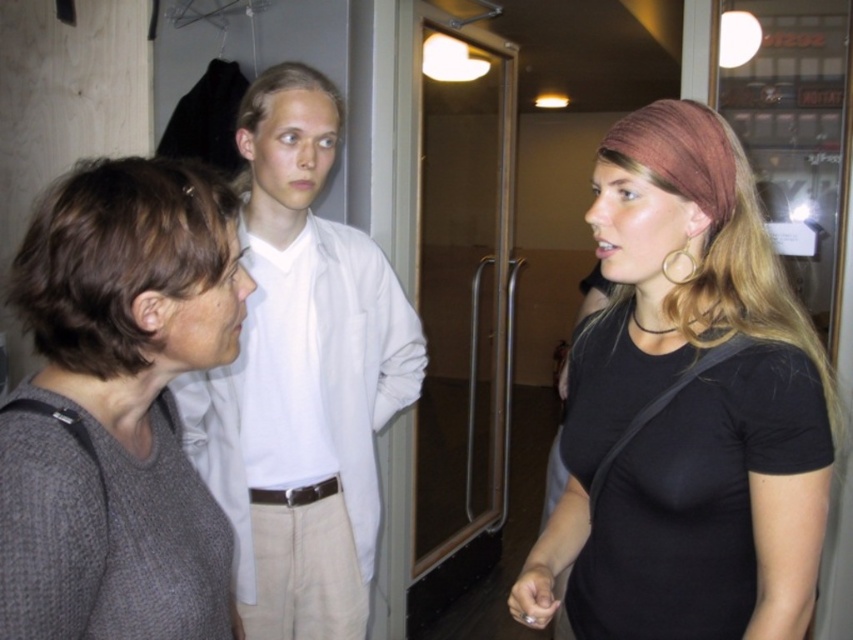
Which of these two, white matte shirt at center or transparent glass door at center, stands taller?

transparent glass door at center

Is point (238, 426) positioned before point (427, 323)?

Yes, point (238, 426) is closer to viewer.

Who is more distant from viewer, (315, 228) or (463, 522)?

Point (463, 522)

Identify the location of white matte shirt at center. This screenshot has width=853, height=640. point(302,378).

Does knitted gray sweater at left come in front of matte black hand at lower center?

Yes, it is.

Find the location of `knitted gray sweater at left`. knitted gray sweater at left is located at coordinates (119, 406).

Locate an element on the screen. knitted gray sweater at left is located at coordinates [119, 406].

Where is `knitted gray sweater at left`? knitted gray sweater at left is located at coordinates (119, 406).

Who is higher up, knitted gray sweater at left or white matte shirt at center?

white matte shirt at center is higher up.

Image resolution: width=853 pixels, height=640 pixels. Identify the location of knitted gray sweater at left. (119, 406).